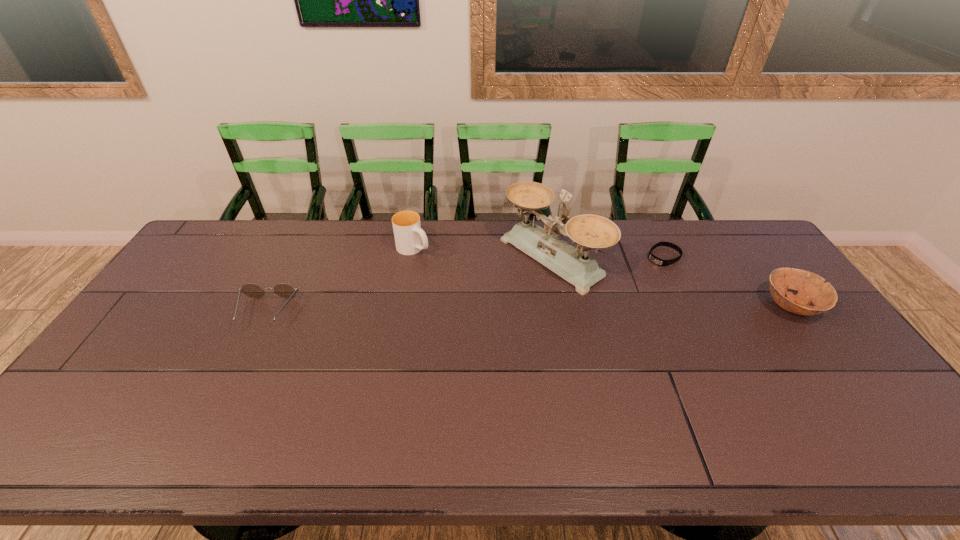
In the image, there is a desktop. Where is `vacant space at the far right corner`? The height and width of the screenshot is (540, 960). vacant space at the far right corner is located at coordinates (710, 232).

Image resolution: width=960 pixels, height=540 pixels. In order to click on free region at the near right corner of the desktop in this screenshot , I will do `click(861, 402)`.

I want to click on unoccupied position between the second object from right to left and the scale, so click(608, 258).

Where is `free space between the wristband and the tallest object`? free space between the wristband and the tallest object is located at coordinates (608, 258).

Where is `unoccupied area between the leftmost object and the wristband`? unoccupied area between the leftmost object and the wristband is located at coordinates (465, 284).

Locate an element on the screen. This screenshot has height=540, width=960. vacant space in between the bowl and the scale is located at coordinates (671, 282).

At what (x,y) coordinates should I click in order to perform the action: click on free space between the spectacles and the third shortest object. Please return your answer as a coordinate pair (x, y). Looking at the image, I should click on (529, 309).

Identify the location of free space that is in between the tallest object and the leftmost object. (409, 285).

Identify which object is the second nearest to the fourth object from right to left. Please provide its 2D coordinates. Your answer should be formatted as a tuple, i.e. [(x, y)], where the tuple contains the x and y coordinates of a point satisfying the conditions above.

[(283, 290)]

At what (x,y) coordinates should I click in order to perform the action: click on the third closest object relative to the third object from left to right. Please return your answer as a coordinate pair (x, y). Looking at the image, I should click on (811, 288).